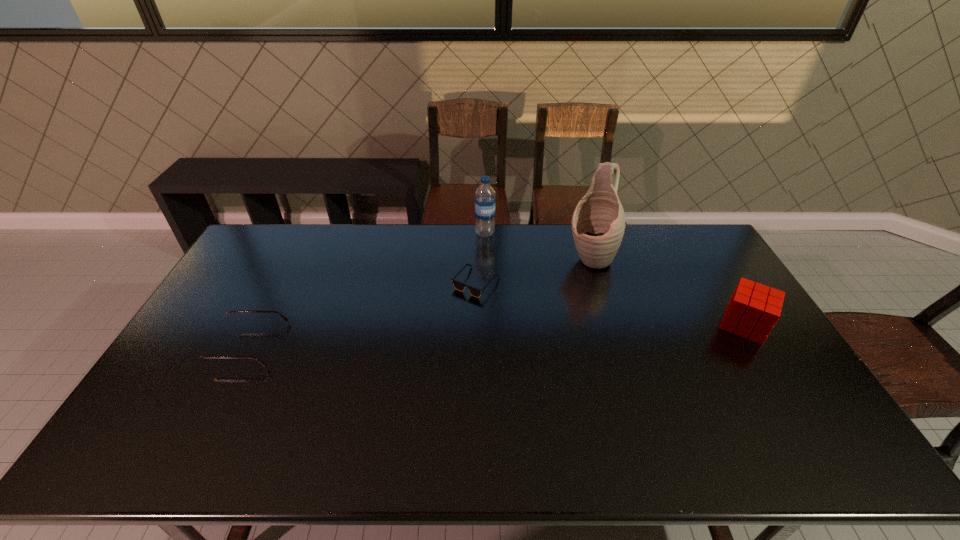
Locate an element on the screen. the fourth tallest object is located at coordinates (209, 350).

Identify the location of spectacles. Image resolution: width=960 pixels, height=540 pixels. (209, 350).

Image resolution: width=960 pixels, height=540 pixels. In order to click on cube in this screenshot , I will do `click(753, 310)`.

Where is `the rightmost object`? the rightmost object is located at coordinates (753, 310).

Image resolution: width=960 pixels, height=540 pixels. I want to click on the fourth object from left to right, so click(598, 222).

Where is `pitcher`? The height and width of the screenshot is (540, 960). pitcher is located at coordinates (598, 222).

I want to click on sunglasses, so click(x=458, y=285).

Locate an element on the screen. the second tallest object is located at coordinates (485, 199).

Where is `the farthest object`? the farthest object is located at coordinates tap(485, 199).

At what (x,y) coordinates should I click in order to perform the action: click on free region located at the hinge ends of the spectacles. Please return your answer as a coordinate pair (x, y). The image size is (960, 540). Looking at the image, I should click on (198, 345).